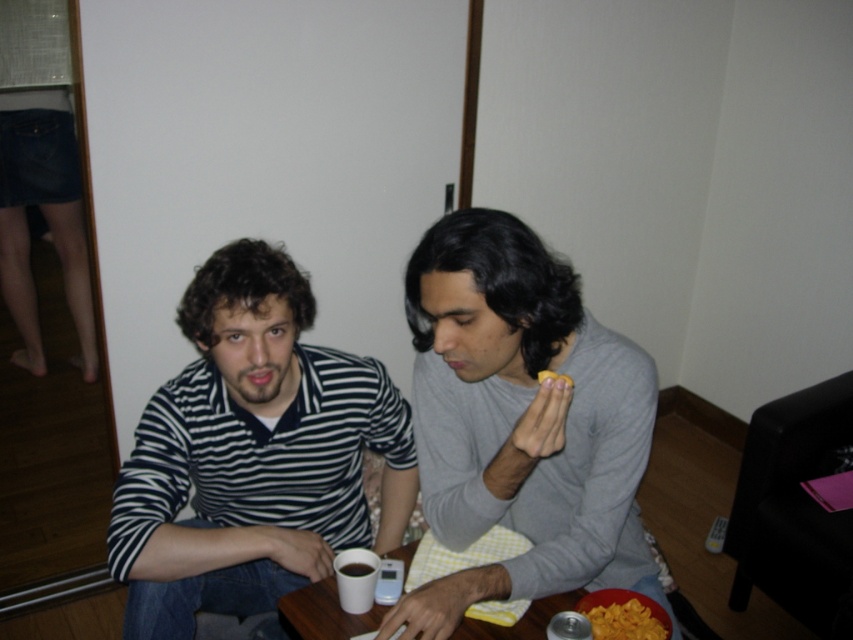
From the picture: You are a delivery robot that needs to place a package between the striped cotton shirt at center and the yellow crispy chips at lower center. The package requires a minimum of 30 inches of space. Can you fit the package between them?

The striped cotton shirt at center is 24.71 inches away from the yellow crispy chips at lower center, which is less than the required 30 inches. Therefore, the package cannot be placed between them.

You are designing a new layout for a cozy cafe and want to ensure there is enough space between the gray matte shirt at center and the white glossy table at center. Based on the image, which object is wider, and would you need to adjust the table size or the seating arrangement?

The gray matte shirt at center might be wider than the white glossy table at center, so you may need to adjust the table size or seating arrangement to accommodate the width difference.